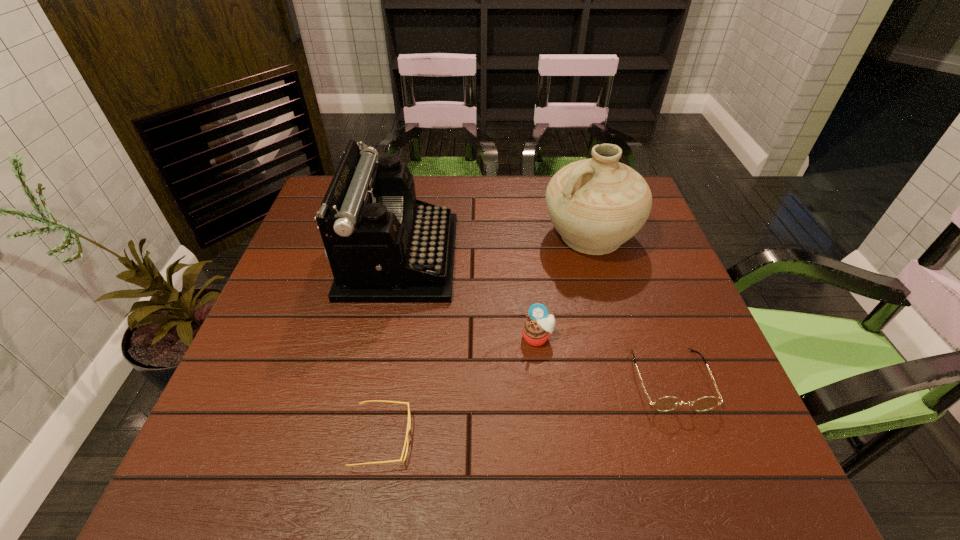
Where is `vacant space at the near edge`? The image size is (960, 540). vacant space at the near edge is located at coordinates (574, 470).

This screenshot has height=540, width=960. In the image, there is a desktop. Find the location of `free region at the left edge`. free region at the left edge is located at coordinates (226, 436).

Where is `blank space at the right edge of the desktop`? This screenshot has height=540, width=960. blank space at the right edge of the desktop is located at coordinates (648, 367).

Locate an element on the screen. vacant area that lies between the pottery and the typewriter is located at coordinates (494, 246).

Image resolution: width=960 pixels, height=540 pixels. I want to click on blank region between the pottery and the shorter spectacles, so click(x=486, y=338).

Find the location of a particular element. The image size is (960, 540). vacant area that lies between the pottery and the shorter spectacles is located at coordinates (486, 338).

Identify the location of free spot between the third shortest object and the shortest object. The width and height of the screenshot is (960, 540). (460, 388).

The height and width of the screenshot is (540, 960). What are the coordinates of `free spot between the typewriter and the pottery` in the screenshot? It's located at (494, 246).

Locate an element on the screen. This screenshot has width=960, height=540. vacant area that lies between the shorter spectacles and the typewriter is located at coordinates (391, 348).

Where is `vacant region between the third tallest object and the shorter spectacles`? vacant region between the third tallest object and the shorter spectacles is located at coordinates (460, 388).